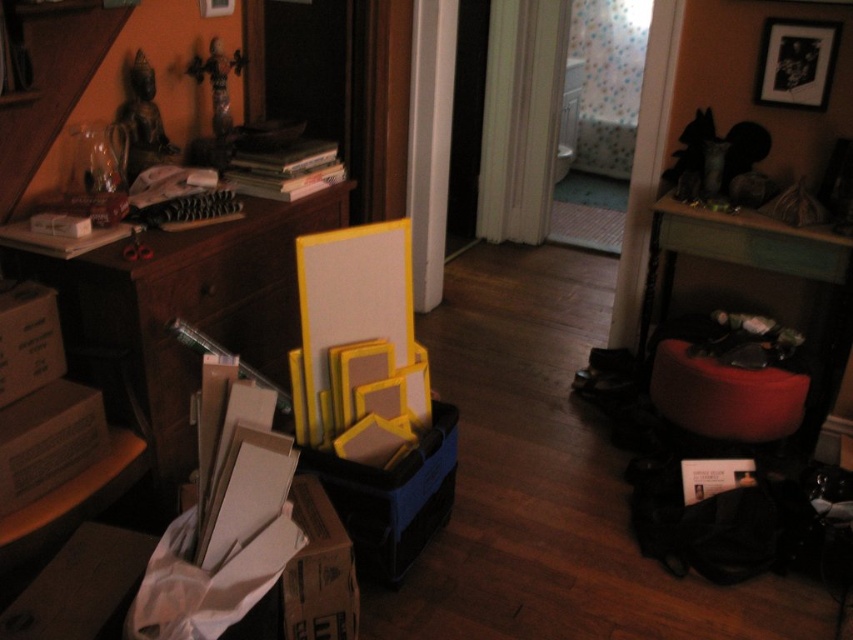
Looking at this image, does wooden drawer at center appear over brown cardboard box at lower left?

Yes, wooden drawer at center is above brown cardboard box at lower left.

Which is below, wooden drawer at center or brown cardboard box at lower left?

brown cardboard box at lower left

Does point (166, 298) come closer to viewer compared to point (36, 428)?

No, it is not.

Find the location of `wooden drawer at center`. wooden drawer at center is located at coordinates (233, 272).

Is point (12, 445) closer to viewer compared to point (9, 362)?

Yes, point (12, 445) is in front of point (9, 362).

Who is shorter, brown cardboard box at lower left or cardboard box at left?

brown cardboard box at lower left is shorter.

The image size is (853, 640). Describe the element at coordinates (48, 440) in the screenshot. I see `brown cardboard box at lower left` at that location.

Image resolution: width=853 pixels, height=640 pixels. Identify the location of brown cardboard box at lower left. pos(48,440).

Between brown cardboard box at lower left and matte black picture frame at upper right, which one has less height?

brown cardboard box at lower left is shorter.

Is point (80, 385) positioned behind point (825, 88)?

That is False.

Where is `brown cardboard box at lower left`? The height and width of the screenshot is (640, 853). brown cardboard box at lower left is located at coordinates (48, 440).